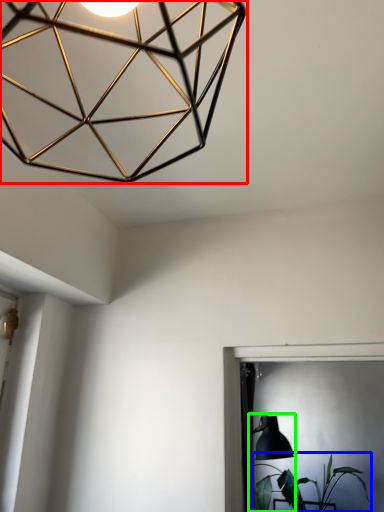
Question: Which object is positioned farthest from lamp (highlighted by a red box)? Select from houseplant (highlighted by a blue box) and table lamp (highlighted by a green box).

Choices:
 (A) houseplant
 (B) table lamp

Answer: (A)